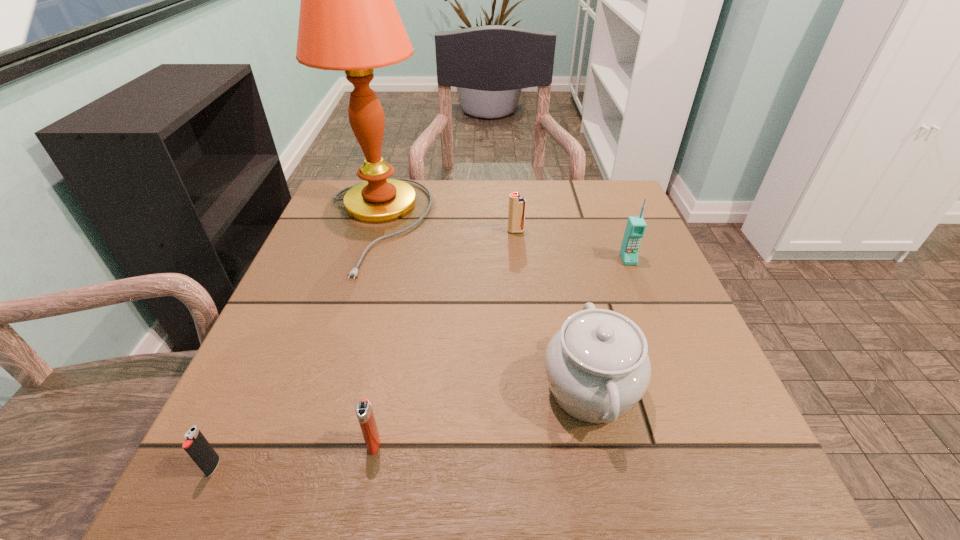
Identify the location of free space between the cellular telephone and the tallest object. (502, 242).

Find the location of `vacant region between the second nearest igniter and the rightmost object`. vacant region between the second nearest igniter and the rightmost object is located at coordinates (501, 352).

At what (x,y) coordinates should I click in order to perform the action: click on free spot between the shortest igniter and the farthest igniter. Please return your answer as a coordinate pair (x, y). The height and width of the screenshot is (540, 960). Looking at the image, I should click on (365, 349).

Locate an element on the screen. vacant region between the chinaware and the farthest igniter is located at coordinates (553, 310).

The image size is (960, 540). Find the location of `vacant region between the chinaware and the second igniter from right to left`. vacant region between the chinaware and the second igniter from right to left is located at coordinates (482, 416).

Where is `free space between the second igniter from left to right and the rightmost igniter`? Image resolution: width=960 pixels, height=540 pixels. free space between the second igniter from left to right and the rightmost igniter is located at coordinates (444, 338).

You are a GUI agent. You are given a task and a screenshot of the screen. Output one action in this format:
    pyautogui.click(x=<x>, y=<y>)
    Task: Click on the vacant space that's between the shortest igniter and the farthest igniter
    The height and width of the screenshot is (540, 960).
    Given the screenshot: What is the action you would take?
    pyautogui.click(x=365, y=349)

The image size is (960, 540). I want to click on the fourth closest object to the rightmost igniter, so click(364, 412).

Identify the location of object that is the second nearest to the chinaware. (364, 412).

Locate which igniter is the second closest to the chinaware. Please provide its 2D coordinates. Your answer should be formatted as a tuple, i.e. [(x, y)], where the tuple contains the x and y coordinates of a point satisfying the conditions above.

[(517, 204)]